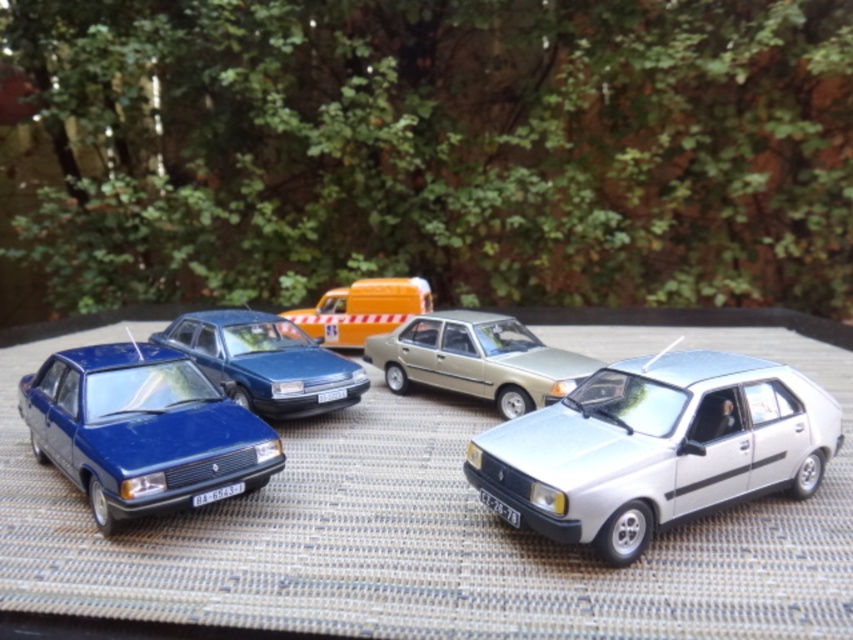
Question: Can you confirm if silver metallic hatchback at lower right is positioned below glossy blue sedan at center?

Choices:
 (A) yes
 (B) no

Answer: (A)

Question: Estimate the real-world distances between objects in this image. Which object is farther from the matte blue sedan at left?

Choices:
 (A) glossy blue sedan at center
 (B) metallic gold sedan at center
 (C) silver metallic hatchback at lower right

Answer: (B)

Question: Is silver metallic hatchback at lower right thinner than glossy blue sedan at center?

Choices:
 (A) no
 (B) yes

Answer: (A)

Question: Can you confirm if silver metallic hatchback at lower right is smaller than matte blue sedan at left?

Choices:
 (A) yes
 (B) no

Answer: (A)

Question: Which object appears farthest from the camera in this image?

Choices:
 (A) silver metallic hatchback at lower right
 (B) glossy blue sedan at center
 (C) yellow matte van at center

Answer: (C)

Question: Which object is closer to the camera taking this photo?

Choices:
 (A) glossy blue sedan at center
 (B) matte blue sedan at left
 (C) yellow matte van at center

Answer: (B)